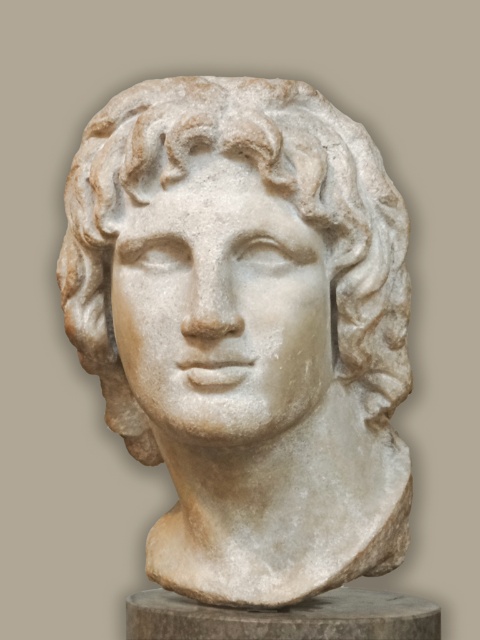
You are an art restorer examining the classical marble sculpture. You notice two parts labeled as the white marble head at center and the white marble bust at center. Which part of the sculpture is bigger in size?

The white marble head at center is larger in size compared to the white marble bust at center.

You are an art conservator examining the classical marble bust. You notice two points on the sculpture labeled as point 1 at coordinates point (373, 356) and point 2 at coordinates point (203, 625). If you were to touch both points with your fingertips, which point would feel closer to you?

Point 1 at coordinates point (373, 356) is further to the viewer than point 2 at coordinates point (203, 625), so touching point 1 would feel closer to you.